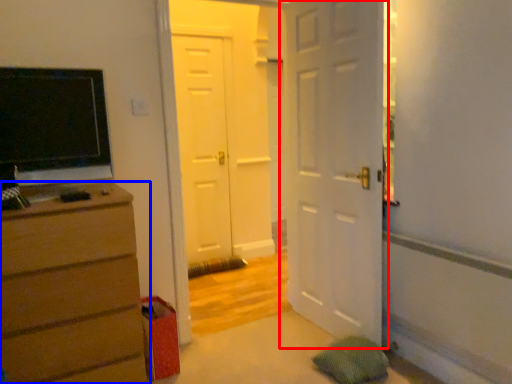
Question: Among these objects, which one is farthest to the camera, door (highlighted by a red box) or chest of drawers (highlighted by a blue box)?

Choices:
 (A) door
 (B) chest of drawers

Answer: (A)